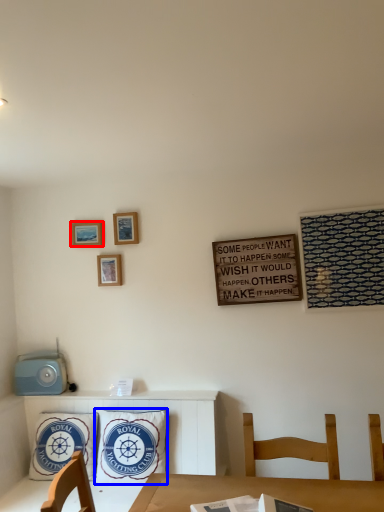
Question: Which of the following is the farthest to the observer, picture frame (highlighted by a red box) or pillow (highlighted by a blue box)?

Choices:
 (A) picture frame
 (B) pillow

Answer: (A)